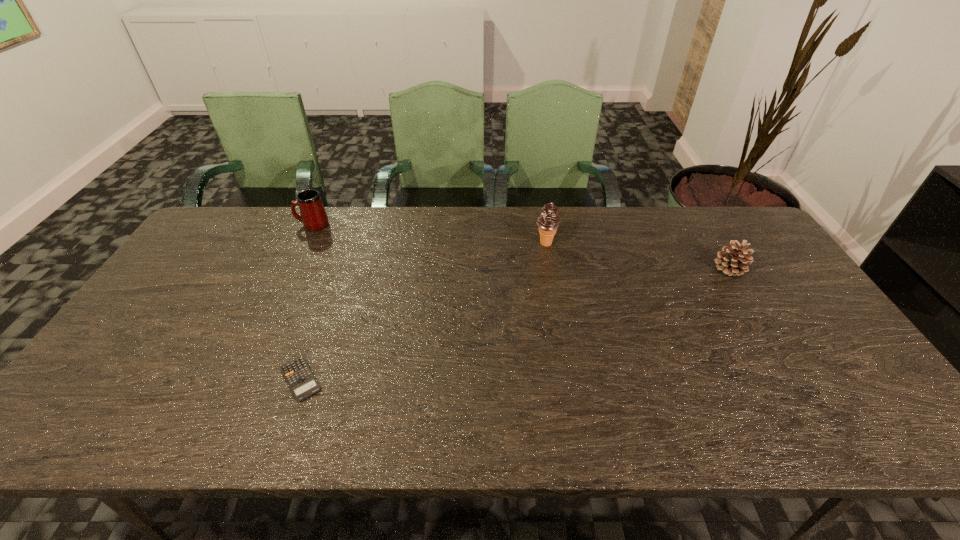
This screenshot has width=960, height=540. I want to click on vacant area at the right edge, so click(819, 374).

At what (x,y) coordinates should I click in order to perform the action: click on vacant area that lies between the second farthest object and the leftmost object. Please return your answer as a coordinate pair (x, y). The image size is (960, 540). Looking at the image, I should click on (429, 234).

Where is `free space between the shortest object and the tallest object`? Image resolution: width=960 pixels, height=540 pixels. free space between the shortest object and the tallest object is located at coordinates (423, 311).

This screenshot has width=960, height=540. Find the location of `vacant space in between the nearest object and the third object from left to right`. vacant space in between the nearest object and the third object from left to right is located at coordinates (423, 311).

The width and height of the screenshot is (960, 540). I want to click on vacant space that's between the third object from right to left and the icecream, so click(423, 311).

Where is `vacant space that is in between the third object from right to left and the mug`? The height and width of the screenshot is (540, 960). vacant space that is in between the third object from right to left and the mug is located at coordinates (306, 302).

The width and height of the screenshot is (960, 540). Identify the location of vacant space that's between the nearest object and the pinecone. (515, 324).

Find the location of a particular element. The height and width of the screenshot is (540, 960). vacant area that lies between the rightmost object and the mug is located at coordinates (521, 247).

The image size is (960, 540). Identify the location of free spot between the icecream and the third farthest object. (637, 256).

You are a GUI agent. You are given a task and a screenshot of the screen. Output one action in this format:
    pyautogui.click(x=<x>, y=<y>)
    Task: Click on the free space between the second object from right to left and the mug
    This screenshot has height=540, width=960.
    Given the screenshot: What is the action you would take?
    pyautogui.click(x=429, y=234)